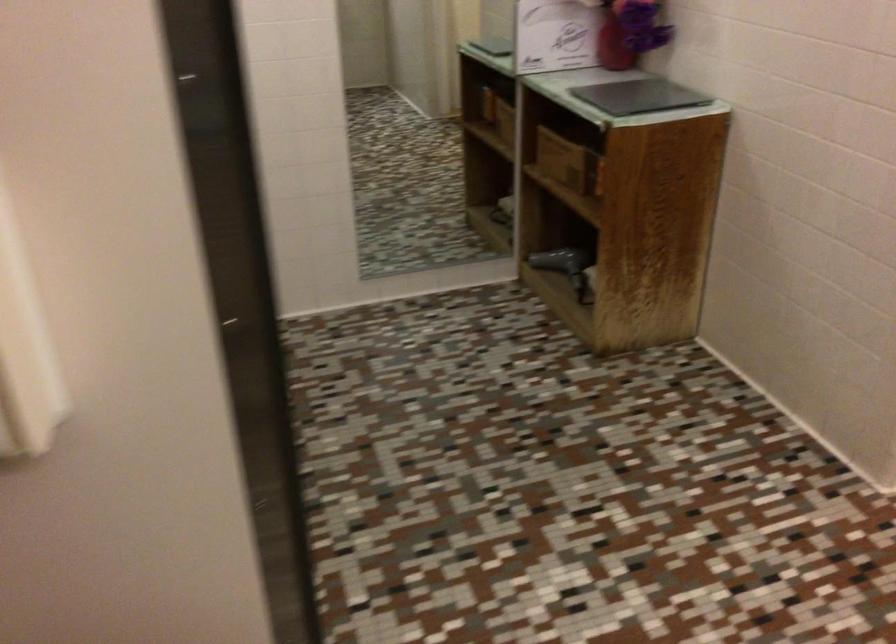
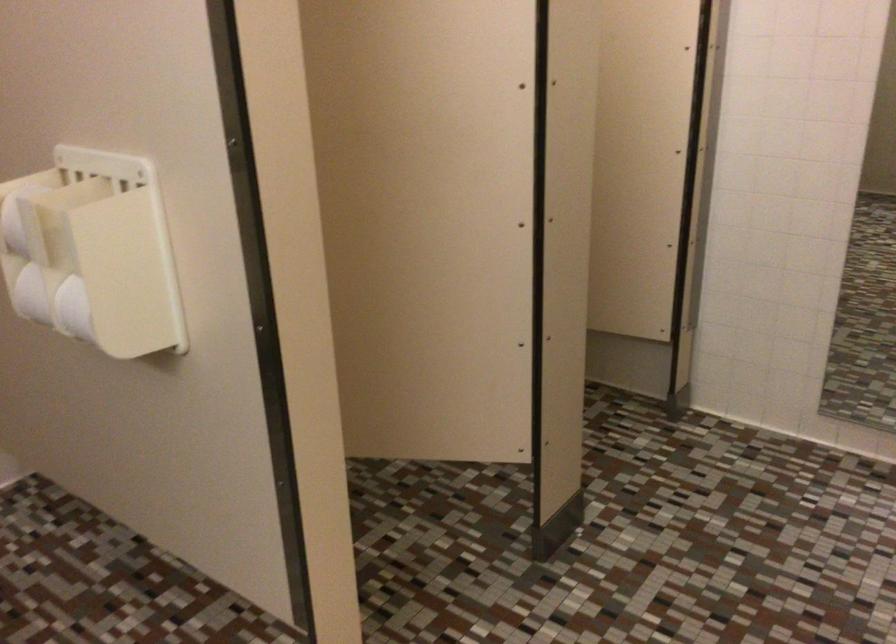
Question: The first image is from the beginning of the video and the second image is from the end. How did the camera likely rotate when shooting the video?

Choices:
 (A) Left
 (B) Right
 (C) Up
 (D) Down

Answer: (A)